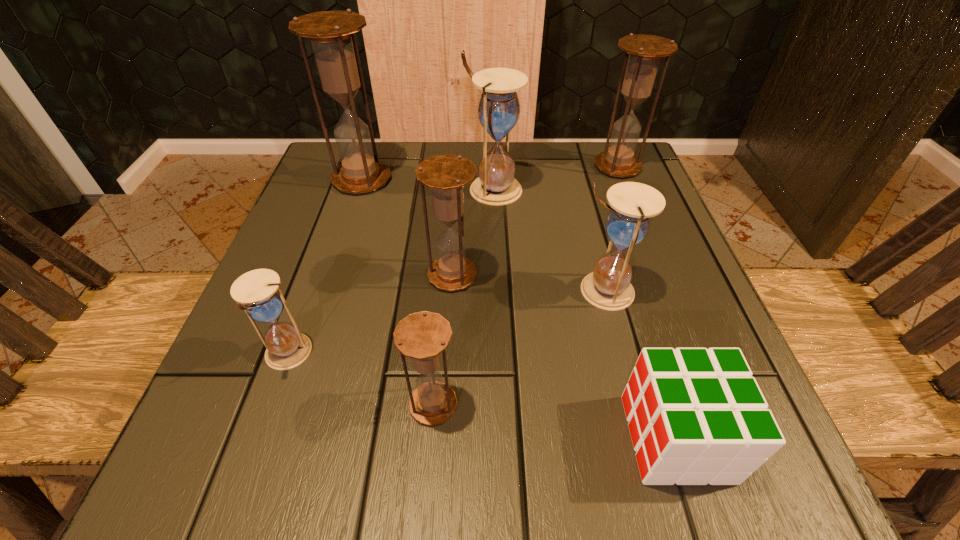
I want to click on the smallest brown hourglass, so click(x=422, y=336).

Identify the location of the nearest brown hourglass. This screenshot has height=540, width=960. (422, 336).

Locate an element on the screen. The width and height of the screenshot is (960, 540). cube is located at coordinates (696, 416).

You are a GUI agent. You are given a task and a screenshot of the screen. Output one action in this format:
    pyautogui.click(x=<x>, y=<y>)
    Task: Click on the red cube
    This screenshot has width=960, height=540.
    Given the screenshot: What is the action you would take?
    pyautogui.click(x=696, y=416)

Identify the location of vacant space situated on the front of the biggest brown hourglass. point(349,218).

Where is `free space located on the front of the second biggest brown hourglass`? free space located on the front of the second biggest brown hourglass is located at coordinates (676, 314).

The image size is (960, 540). In order to click on free space located 0.340m on the front of the biggest white hourglass in this screenshot , I will do `click(498, 341)`.

Identify the location of vacant space positioned 0.240m on the back of the third farthest brown hourglass. (458, 183).

In order to click on free region located on the back of the rightmost white hourglass in this screenshot , I will do pyautogui.click(x=586, y=224).

This screenshot has width=960, height=540. In order to click on vacant area situated on the right of the smallest white hourglass in this screenshot , I will do `click(357, 354)`.